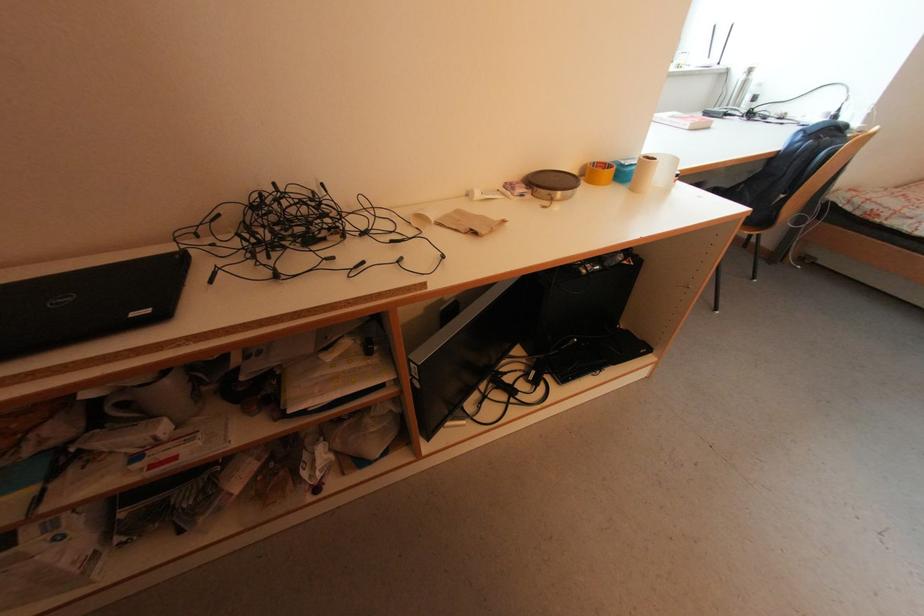
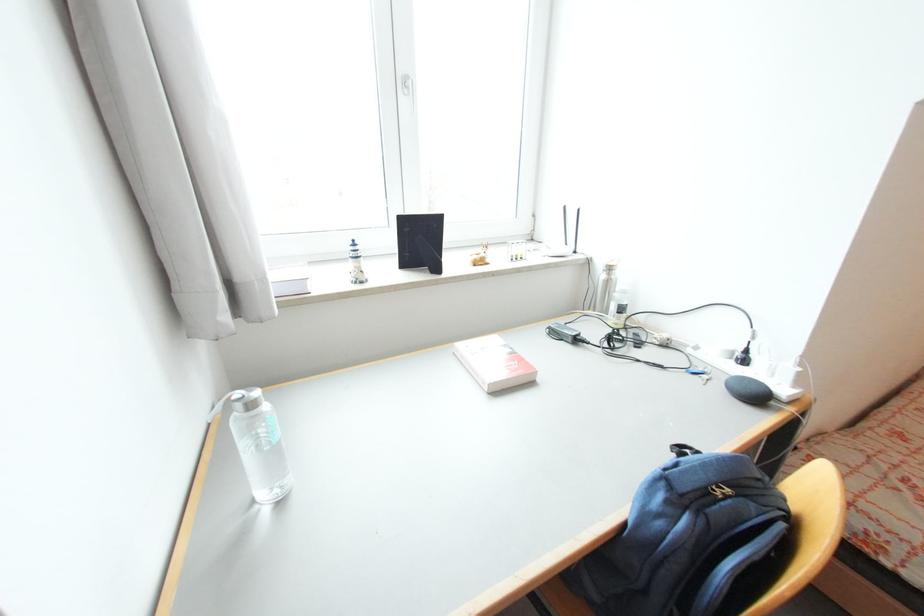
Locate, in the second image, the point that corresponds to point 833,139 in the first image.

(734, 492)